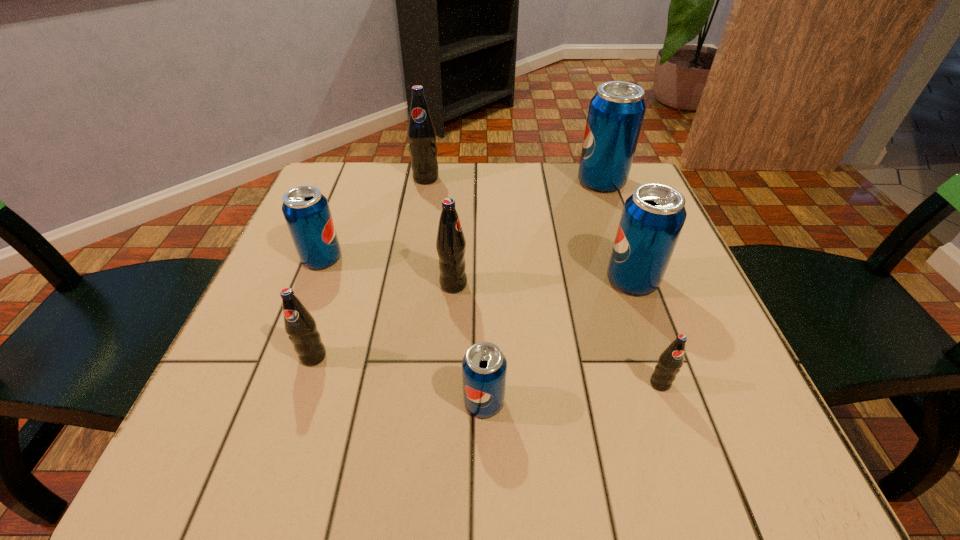
Where is `the second blue pop soda from left to right`? the second blue pop soda from left to right is located at coordinates (484, 367).

Locate an element on the screen. the nearest black pop is located at coordinates (670, 361).

The image size is (960, 540). Identify the location of the smallest black pop. (670, 361).

At what (x,y) coordinates should I click in order to perform the action: click on free location located 0.340m on the left of the biggest blue pop soda. Please return your answer as a coordinate pair (x, y). This screenshot has width=960, height=540. Looking at the image, I should click on (444, 181).

The image size is (960, 540). I want to click on vacant space located 0.180m on the front label of the third pop from left to right, so click(418, 230).

At what (x,y) coordinates should I click in order to perform the action: click on vacant region located on the front of the second biggest blue pop soda. Please return your answer as a coordinate pair (x, y). The image size is (960, 540). Looking at the image, I should click on (677, 404).

Where is `free space located on the front label of the second biggest black pop`? free space located on the front label of the second biggest black pop is located at coordinates point(549,285).

This screenshot has width=960, height=540. Find the location of `vacant space situated on the right of the leftmost blue pop soda`. vacant space situated on the right of the leftmost blue pop soda is located at coordinates (396, 259).

At what (x,y) coordinates should I click in order to perform the action: click on free spot located on the front label of the leftmost black pop. Please return your answer as a coordinate pair (x, y). The height and width of the screenshot is (540, 960). Looking at the image, I should click on (300, 395).

Identify the location of vacant space situated 0.100m on the left of the smallest blue pop soda. (398, 402).